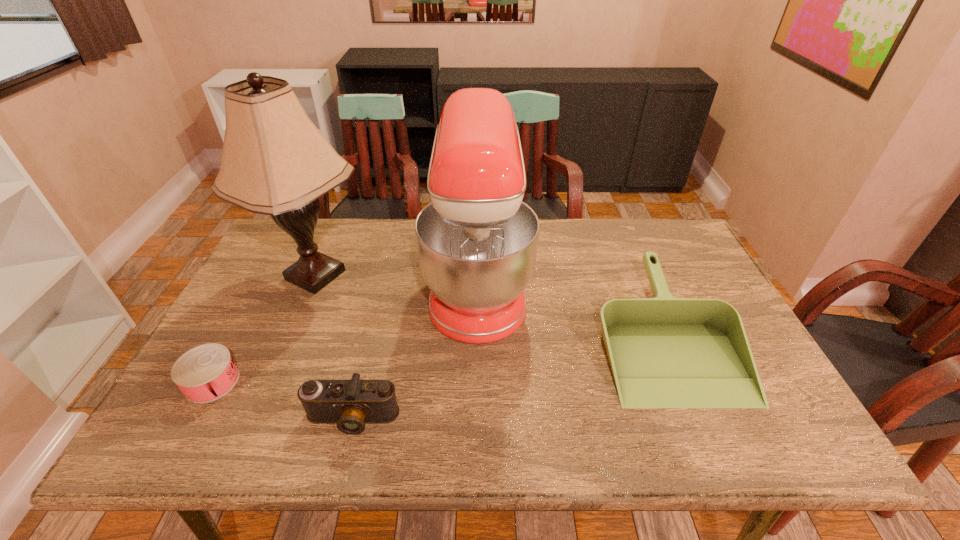
Choose which object is the nearest neighbor to the rightmost object. Please provide its 2D coordinates. Your answer should be formatted as a tuple, i.e. [(x, y)], where the tuple contains the x and y coordinates of a point satisfying the conditions above.

[(477, 242)]

Choose which object is the third nearest neighbor to the lamp. Please provide its 2D coordinates. Your answer should be formatted as a tuple, i.e. [(x, y)], where the tuple contains the x and y coordinates of a point satisfying the conditions above.

[(350, 404)]